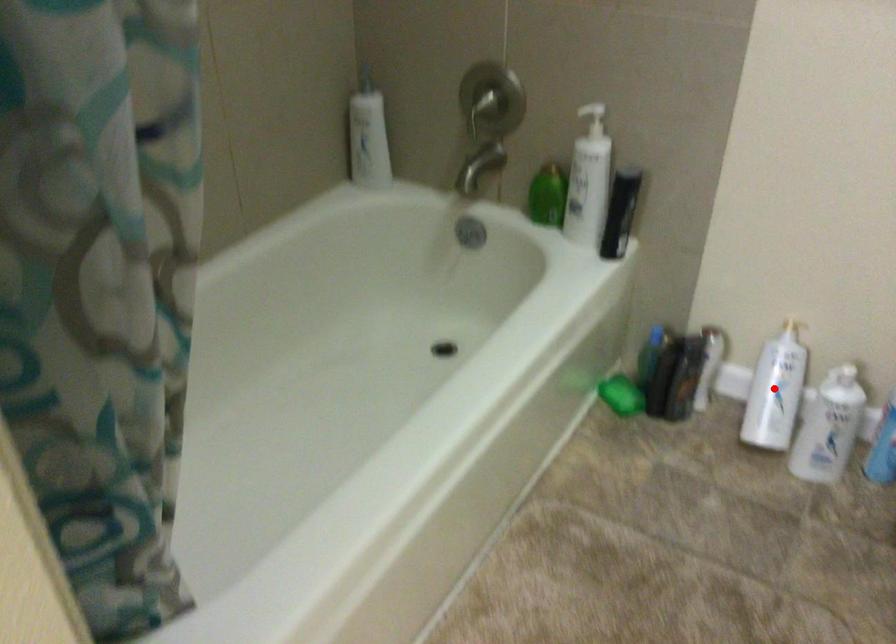
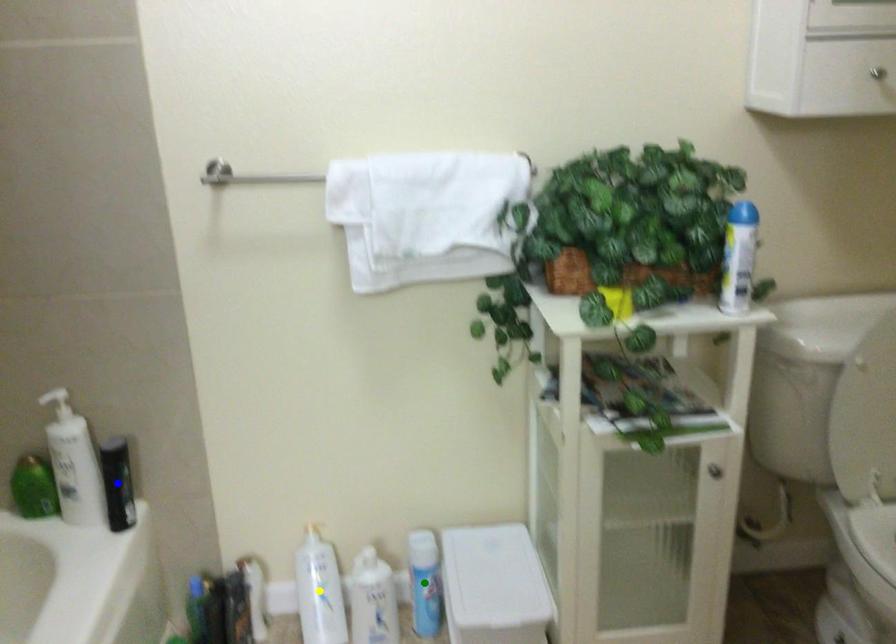
Question: I am providing you with two images of the same scene from different viewpoints. A red point is marked on the first image. You are given multiple points on the second image. Which spot in image 2 lines up with the point in image 1?

Choices:
 (A) yellow point
 (B) blue point
 (C) green point

Answer: (A)